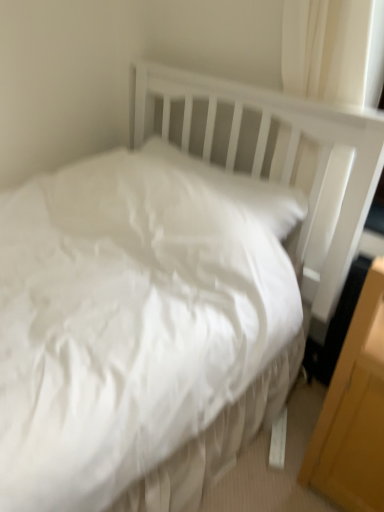
Question: From the image's perspective, is white soft pillow at upper center located above or below white fabric curtain at upper right?

Choices:
 (A) below
 (B) above

Answer: (A)

Question: In the image, is white soft pillow at upper center on the left side or the right side of white fabric curtain at upper right?

Choices:
 (A) right
 (B) left

Answer: (B)

Question: Estimate the real-world distances between objects in this image. Which object is farther from the white soft pillow at upper center?

Choices:
 (A) yellow wood/file cabinet at lower right
 (B) white fabric curtain at upper right

Answer: (A)

Question: Which is farther from the white fabric curtain at upper right?

Choices:
 (A) yellow wood/file cabinet at lower right
 (B) white soft pillow at upper center

Answer: (A)